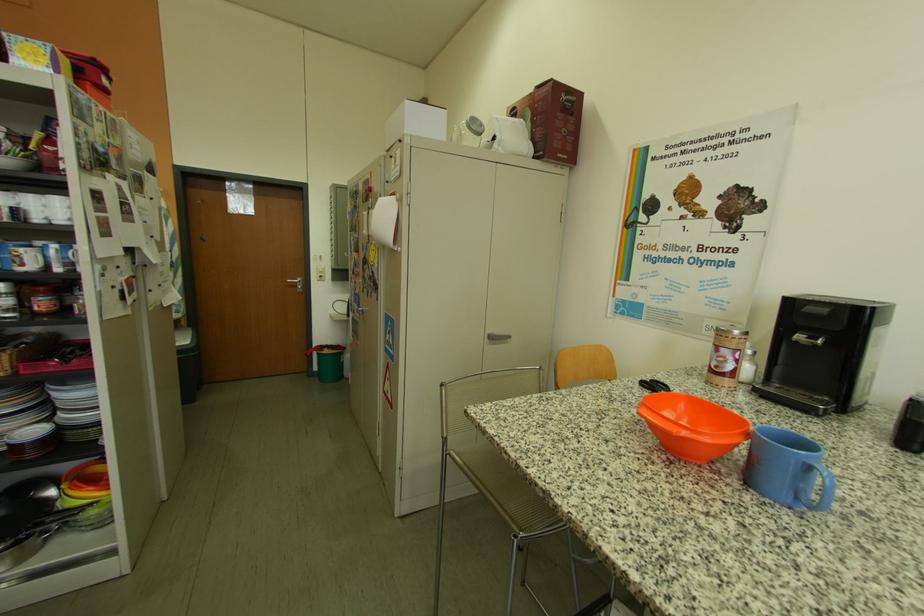
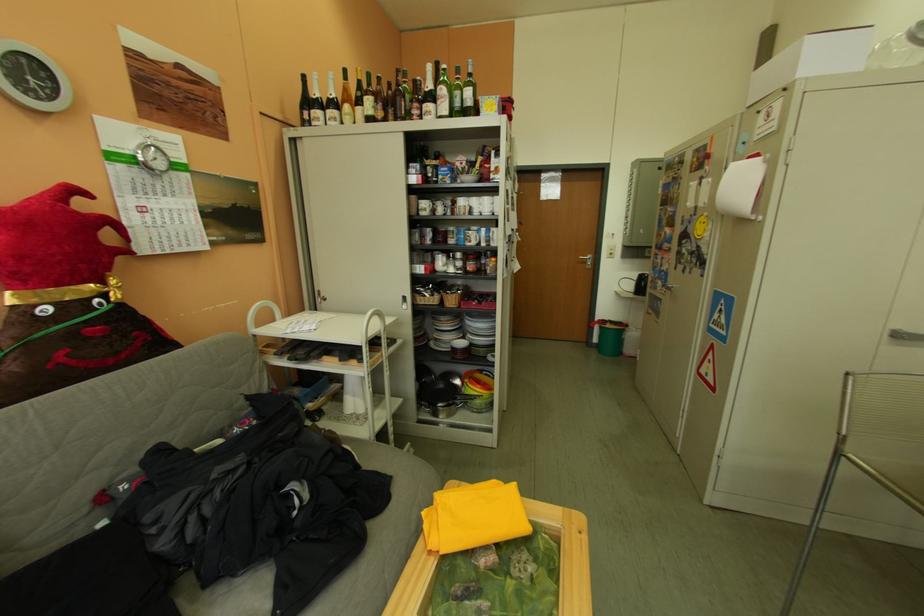
In the second image, find the point that corresponds to [46,435] in the first image.

(473, 346)